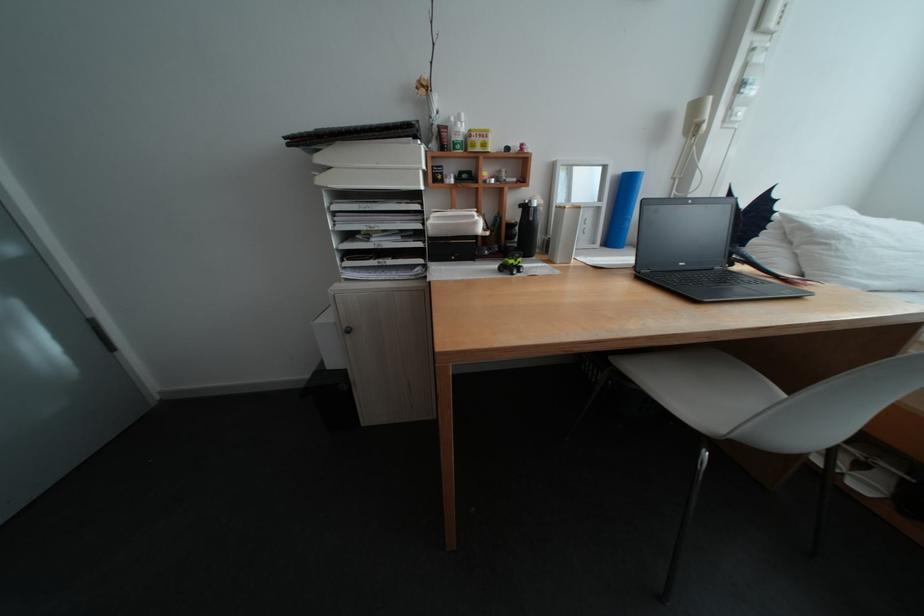
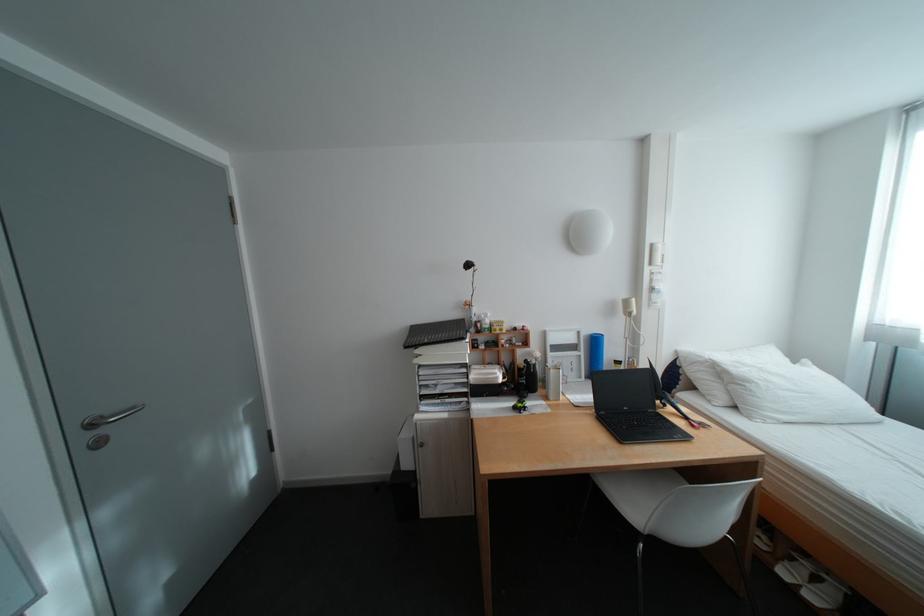
Locate, in the second image, the point that corresponds to (849,240) in the first image.

(761, 384)